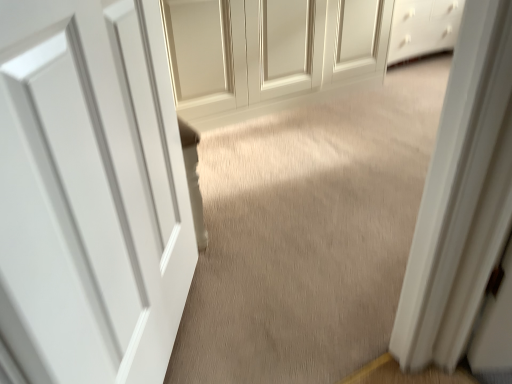
Question: Which is correct: matte white door at center, the 1th door positioned from the top, is inside beige carpet at center, or outside of it?

Choices:
 (A) inside
 (B) outside

Answer: (B)

Question: Considering the positions of matte white door at center, the first door when ordered from back to front, and beige carpet at center in the image, is matte white door at center, the first door when ordered from back to front, taller or shorter than beige carpet at center?

Choices:
 (A) short
 (B) tall

Answer: (B)

Question: Which is farther from the beige carpet at center?

Choices:
 (A) matte white door at center, the second door viewed from the front
 (B) white smooth door at center, which appears as the second door when viewed from the top

Answer: (B)

Question: Which object is positioned farthest from the matte white door at center, the second door viewed from the front?

Choices:
 (A) beige carpet at center
 (B) white smooth door at center, which is the 1th door in front-to-back order

Answer: (B)